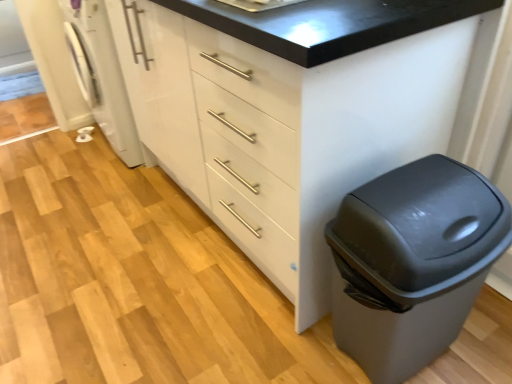
Question: Is matte gray trash can at lower right turned away from white glossy washing machine at left?

Choices:
 (A) no
 (B) yes

Answer: (B)

Question: Does matte gray trash can at lower right have a larger size compared to white glossy washing machine at left?

Choices:
 (A) no
 (B) yes

Answer: (A)

Question: Can you confirm if matte gray trash can at lower right is thinner than white glossy washing machine at left?

Choices:
 (A) no
 (B) yes

Answer: (B)

Question: From a real-world perspective, is matte gray trash can at lower right beneath white glossy washing machine at left?

Choices:
 (A) no
 (B) yes

Answer: (B)

Question: From a real-world perspective, is matte gray trash can at lower right physically above white glossy washing machine at left?

Choices:
 (A) no
 (B) yes

Answer: (A)

Question: Does matte gray trash can at lower right contain white glossy washing machine at left?

Choices:
 (A) no
 (B) yes

Answer: (A)

Question: Is white glossy washing machine at left thinner than matte gray trash can at lower right?

Choices:
 (A) yes
 (B) no

Answer: (B)

Question: Are white glossy washing machine at left and matte gray trash can at lower right located far from each other?

Choices:
 (A) yes
 (B) no

Answer: (A)

Question: Considering the relative sizes of white glossy washing machine at left and matte gray trash can at lower right in the image provided, is white glossy washing machine at left wider than matte gray trash can at lower right?

Choices:
 (A) yes
 (B) no

Answer: (A)

Question: Is white glossy washing machine at left taller than matte gray trash can at lower right?

Choices:
 (A) yes
 (B) no

Answer: (A)

Question: Is white glossy washing machine at left outside matte gray trash can at lower right?

Choices:
 (A) no
 (B) yes

Answer: (B)

Question: Considering the relative sizes of white glossy washing machine at left and matte gray trash can at lower right in the image provided, is white glossy washing machine at left shorter than matte gray trash can at lower right?

Choices:
 (A) yes
 (B) no

Answer: (B)

Question: From a real-world perspective, does white glossy washing machine at left stand above white glossy cabinet at center?

Choices:
 (A) yes
 (B) no

Answer: (B)